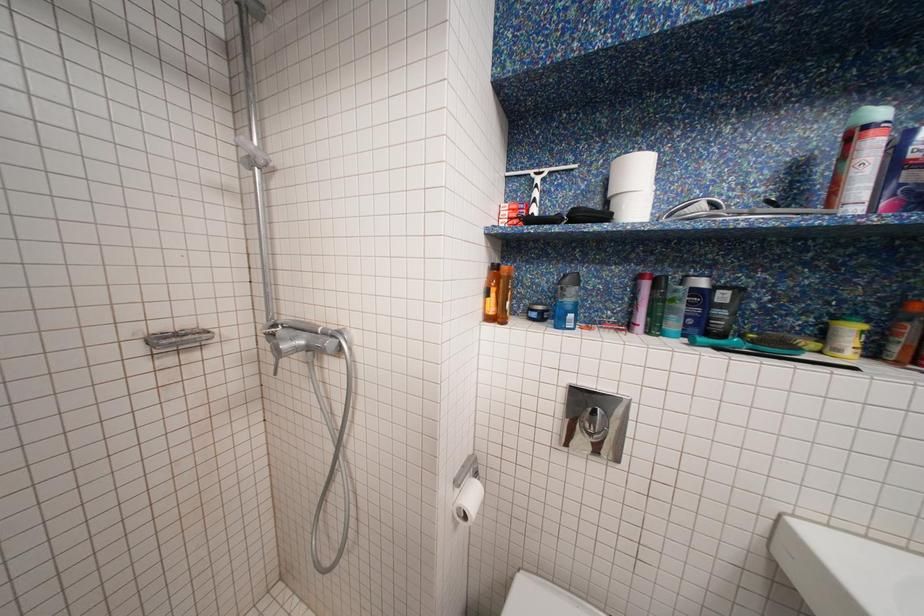
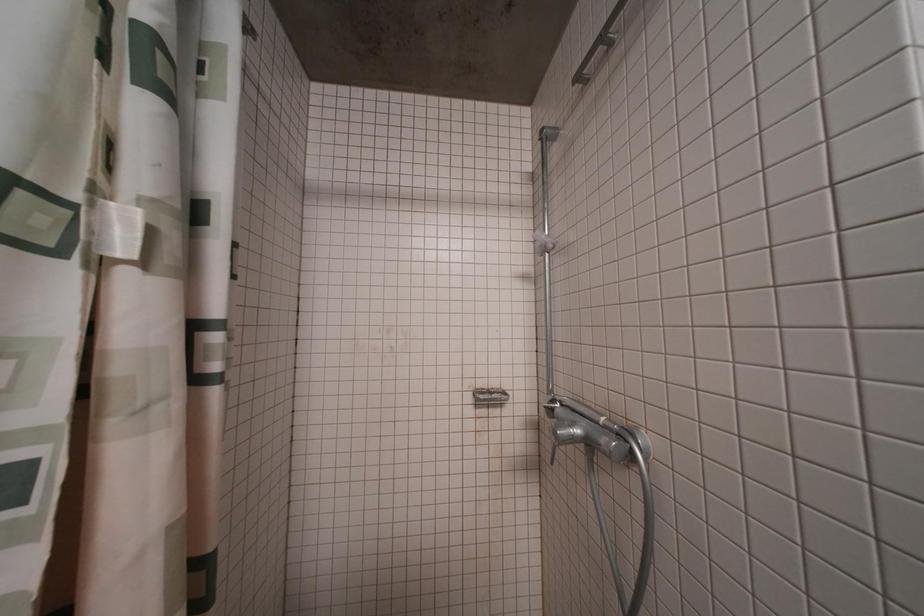
Question: Based on the continuous images, in which direction is the camera rotating? Reply with the corresponding letter.

Choices:
 (A) Left
 (B) Right
 (C) Up
 (D) Down

Answer: (A)